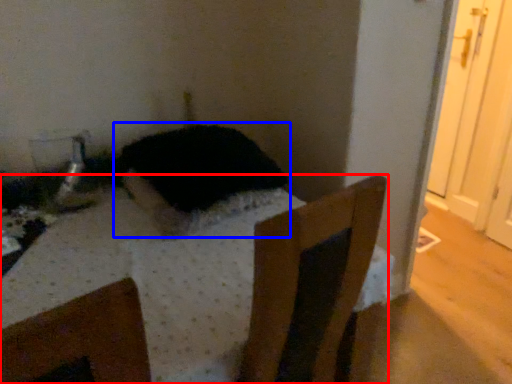
Question: Which point is closer to the camera, furniture (highlighted by a red box) or animal (highlighted by a blue box)?

Choices:
 (A) furniture
 (B) animal

Answer: (A)